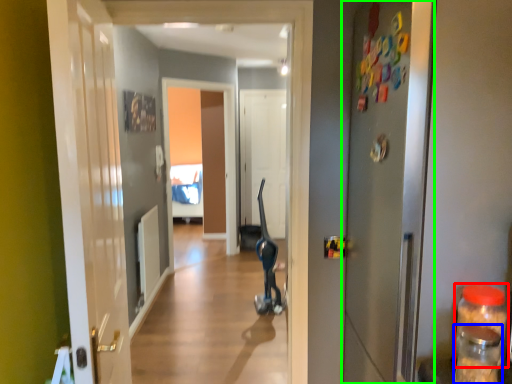
Question: Estimate the real-world distances between objects in this image. Which object is farther from bottle (highlighted by a red box), bottle (highlighted by a blue box) or door (highlighted by a green box)?

Choices:
 (A) bottle
 (B) door

Answer: (B)